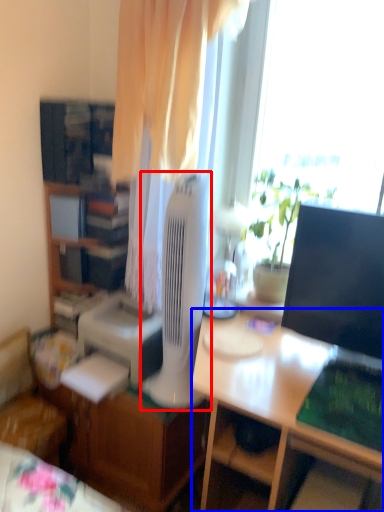
Question: Which object appears closest to the camera in this image, mechanical fan (highlighted by a red box) or desk (highlighted by a blue box)?

Choices:
 (A) mechanical fan
 (B) desk

Answer: (B)